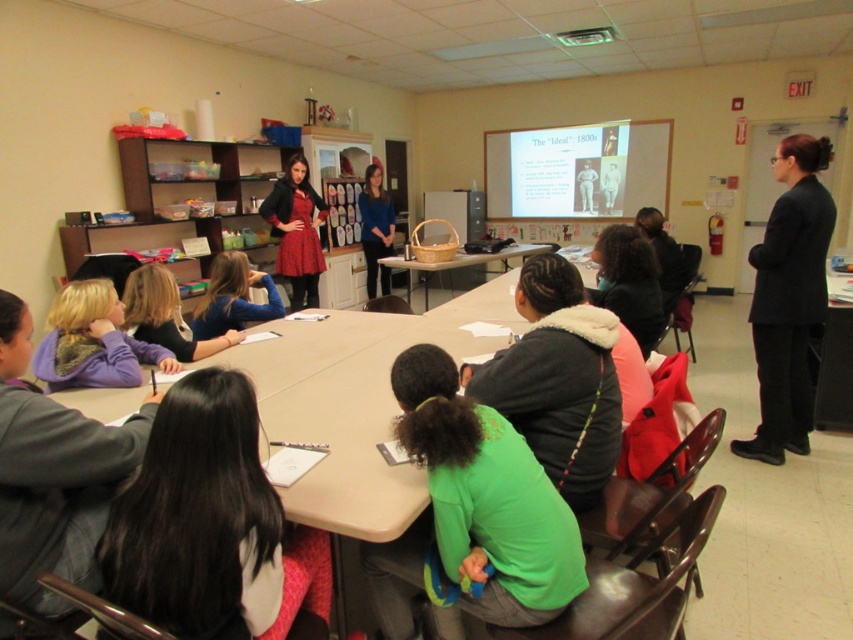
Question: Which point is closer to the camera?

Choices:
 (A) matte white slide at upper center
 (B) green fabric backpack at center
 (C) wooden table at center

Answer: (B)

Question: Can you confirm if black matte suit at right is bigger than matte white slide at upper center?

Choices:
 (A) yes
 (B) no

Answer: (B)

Question: Is black matte suit at right in front of wooden table at center?

Choices:
 (A) no
 (B) yes

Answer: (B)

Question: Can you confirm if green fabric backpack at center is bigger than matte white slide at upper center?

Choices:
 (A) no
 (B) yes

Answer: (A)

Question: Which point appears closest to the camera in this image?

Choices:
 (A) (784, 426)
 (B) (500, 168)

Answer: (A)

Question: Which point is closer to the camera?

Choices:
 (A) wooden table at center
 (B) green fabric backpack at center
 (C) black matte suit at right

Answer: (B)